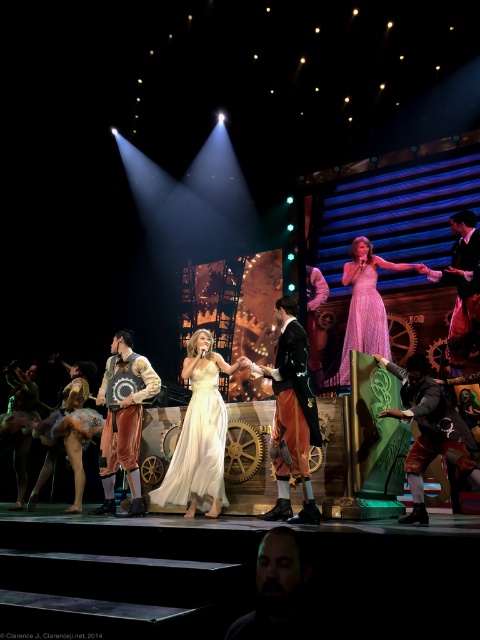
Question: Is leather vest at center bigger than shiny silver dress at lower left?

Choices:
 (A) no
 (B) yes

Answer: (B)

Question: Does leather jacket at center have a greater width compared to matte gold dress at lower left?

Choices:
 (A) yes
 (B) no

Answer: (B)

Question: Among these objects, which one is nearest to the camera?

Choices:
 (A) black leather jacket at right
 (B) pink satin dress at center
 (C) velvet black coat at center
 (D) white satin dress at center

Answer: (C)

Question: Is leather jacket at center above pink satin dress at center?

Choices:
 (A) no
 (B) yes

Answer: (A)

Question: Which of the following is the closest to the observer?

Choices:
 (A) (287, 374)
 (B) (117, 461)
 (C) (20, 420)

Answer: (A)

Question: Among these points, which one is nearest to the camera?

Choices:
 (A) (37, 433)
 (B) (309, 436)
 (C) (284, 385)

Answer: (B)